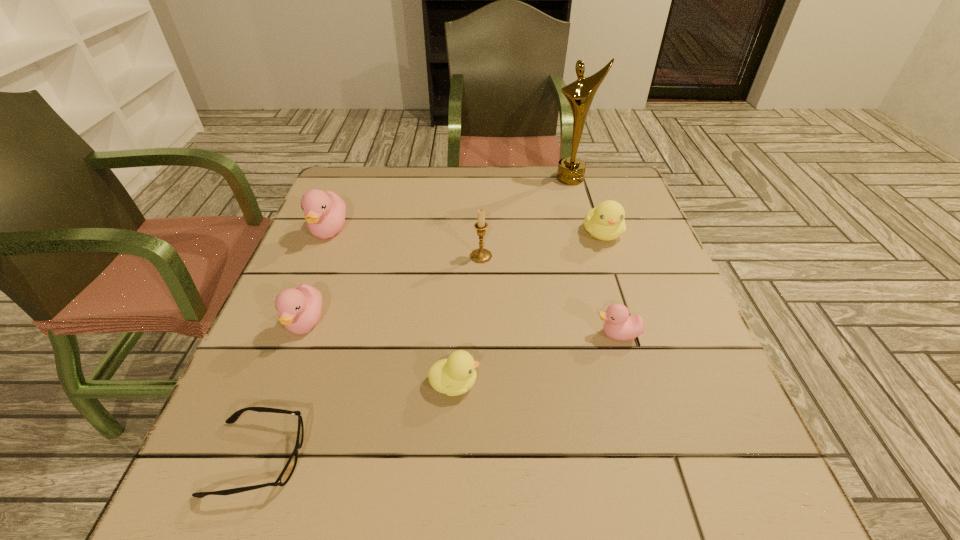
Identify the location of pink duckling object that ranks as the second closest to the nearest duckling. This screenshot has width=960, height=540. (619, 325).

Image resolution: width=960 pixels, height=540 pixels. Identify the location of vacant region that satisfies the following two spatial constraints: 1. at the beak of the bigger yellow duckling; 2. on the front-facing side of the spectacles. (677, 458).

Identify the location of free spot that satisfies the following two spatial constraints: 1. at the beak of the right yellow duckling; 2. on the front-facing side of the spectacles. (677, 458).